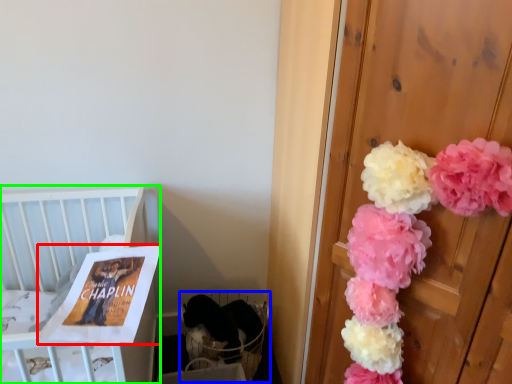
Question: Which is nearer to the magazine (highlighted by a red box)? baby carriage (highlighted by a blue box) or furniture (highlighted by a green box).

Choices:
 (A) baby carriage
 (B) furniture

Answer: (B)